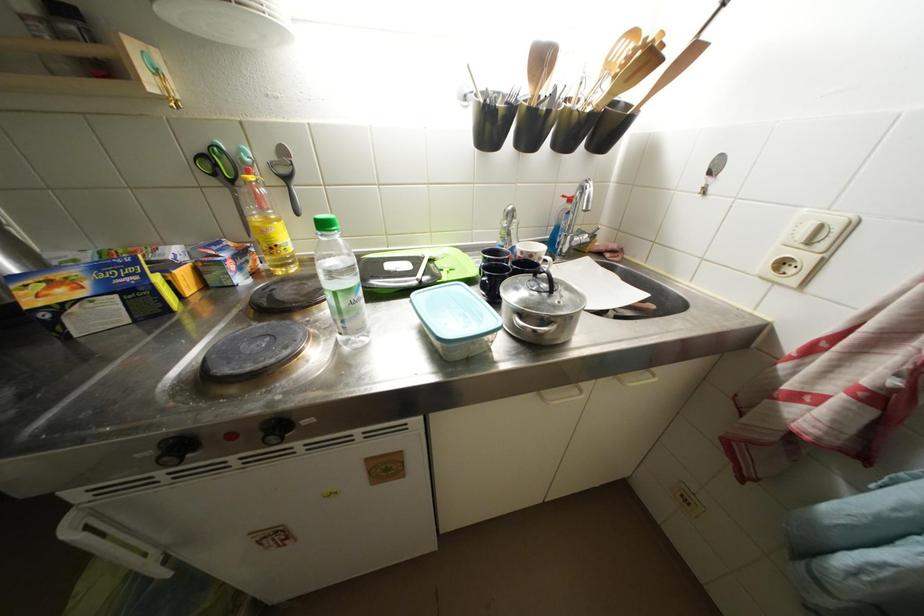
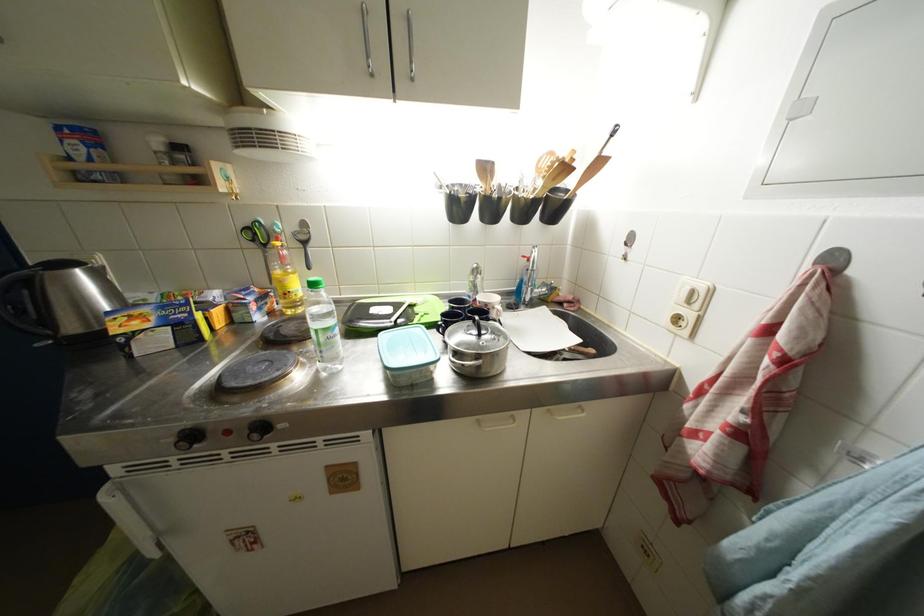
The point at (816,246) is marked in the first image. Where is the corresponding point in the second image?

(696, 306)